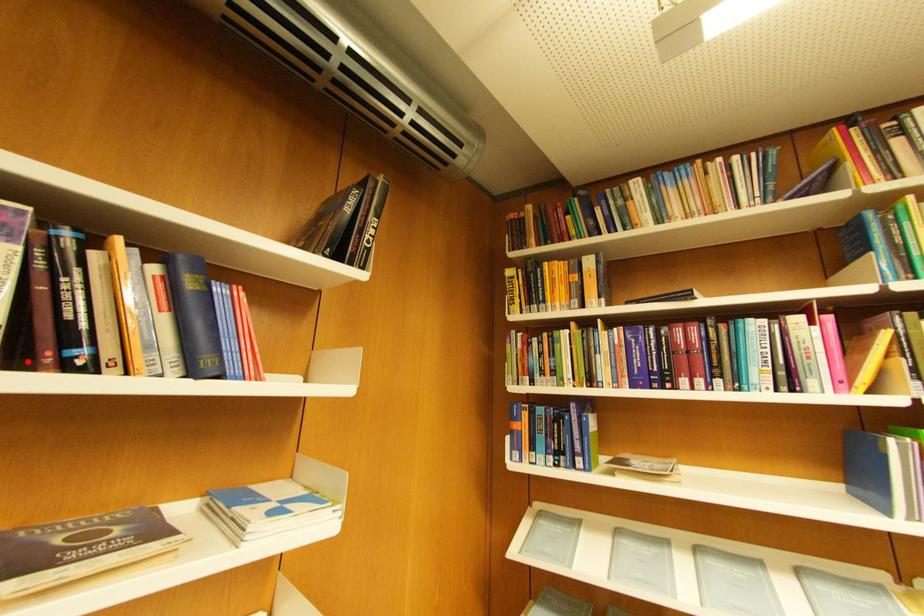
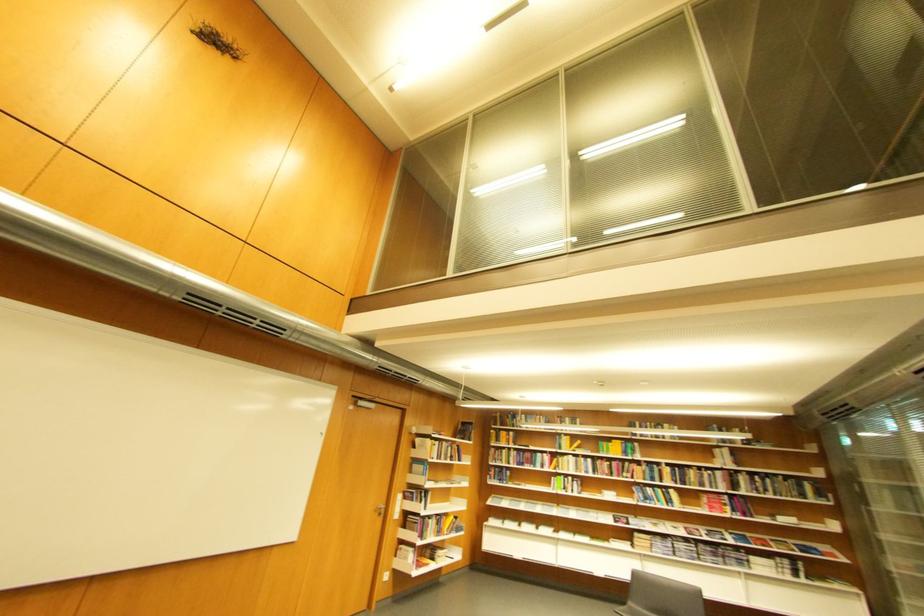
Find the pixel in the second image that matches the highlighted location in the first image.

(460, 461)